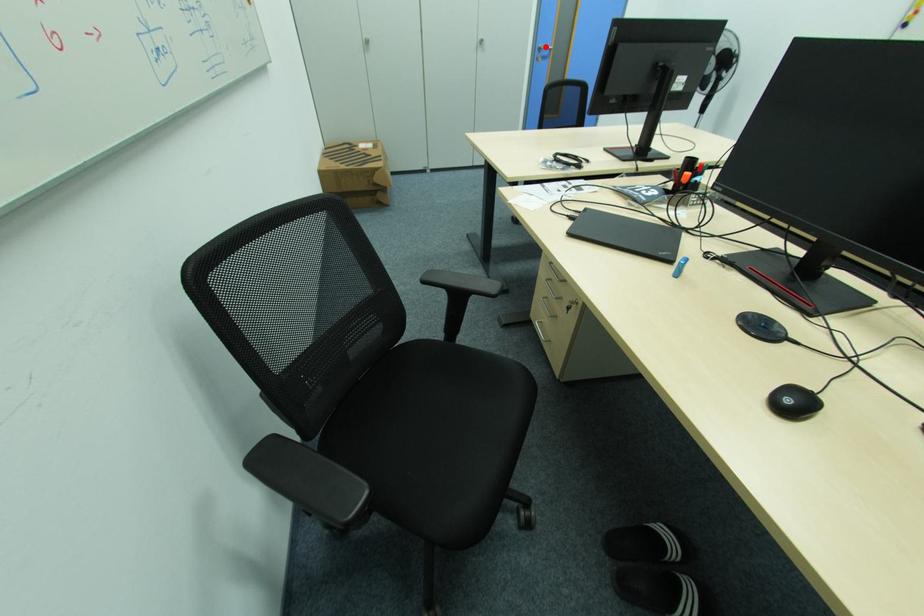
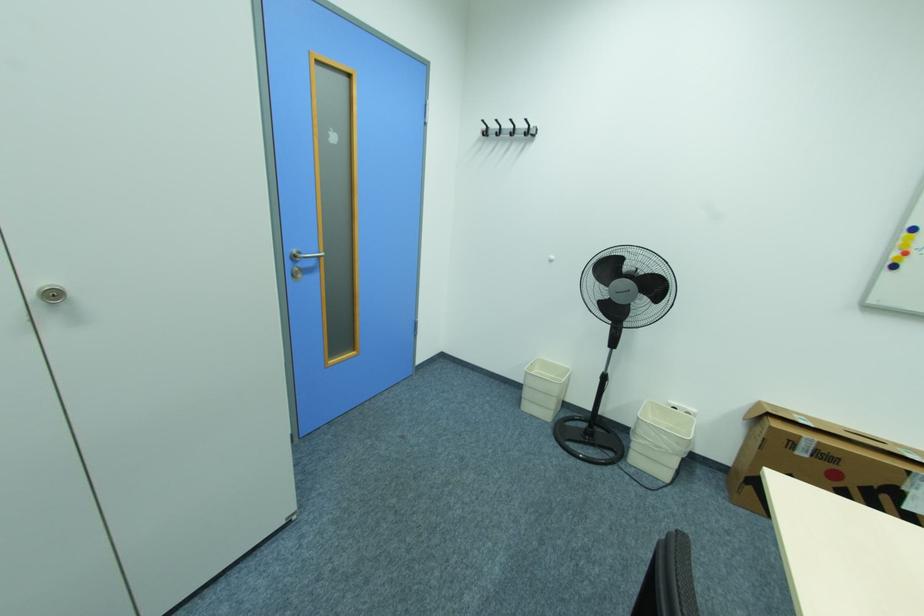
The point at the highlighted location is marked in the first image. Where is the corresponding point in the second image?

(300, 252)